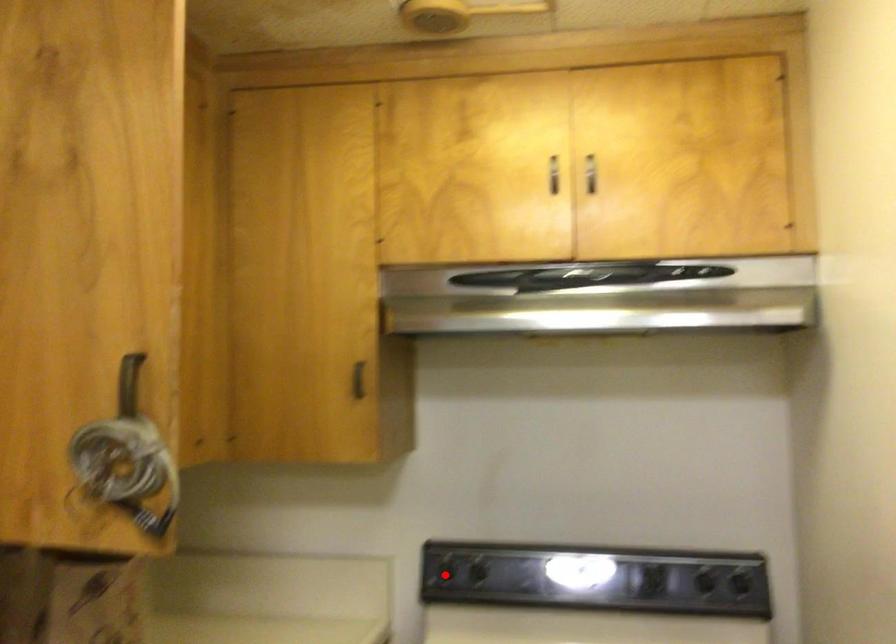
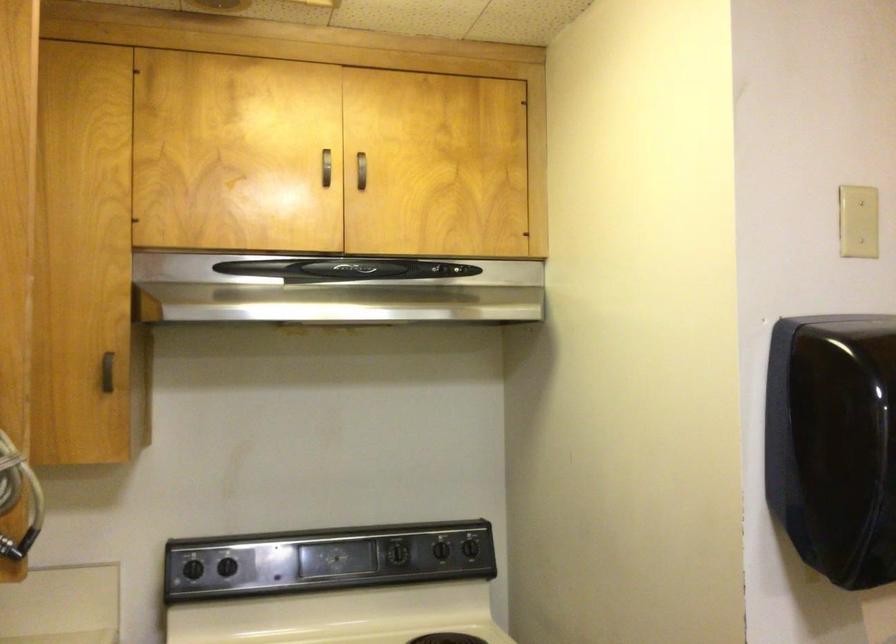
Locate, in the second image, the point that corresponds to the highlighted location in the first image.

(193, 569)